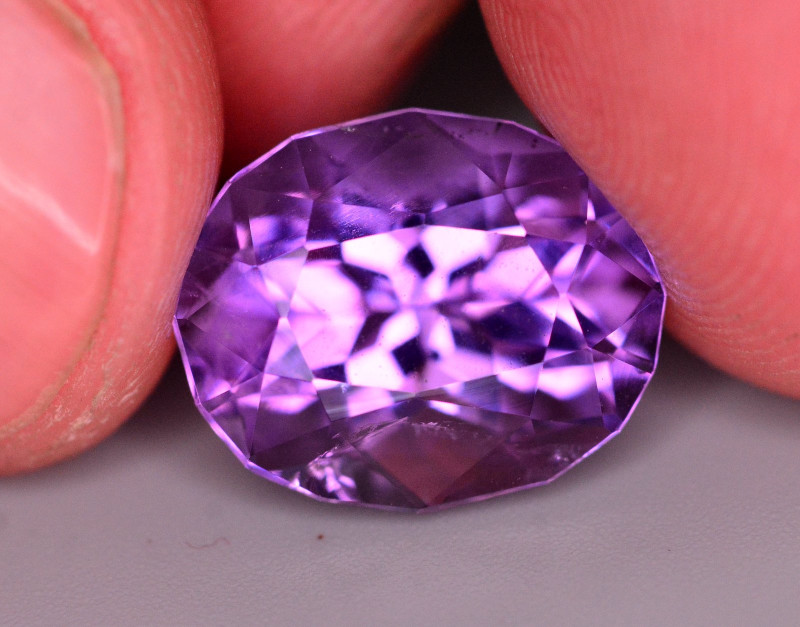
Where is `tables`? tables is located at coordinates (629, 561).